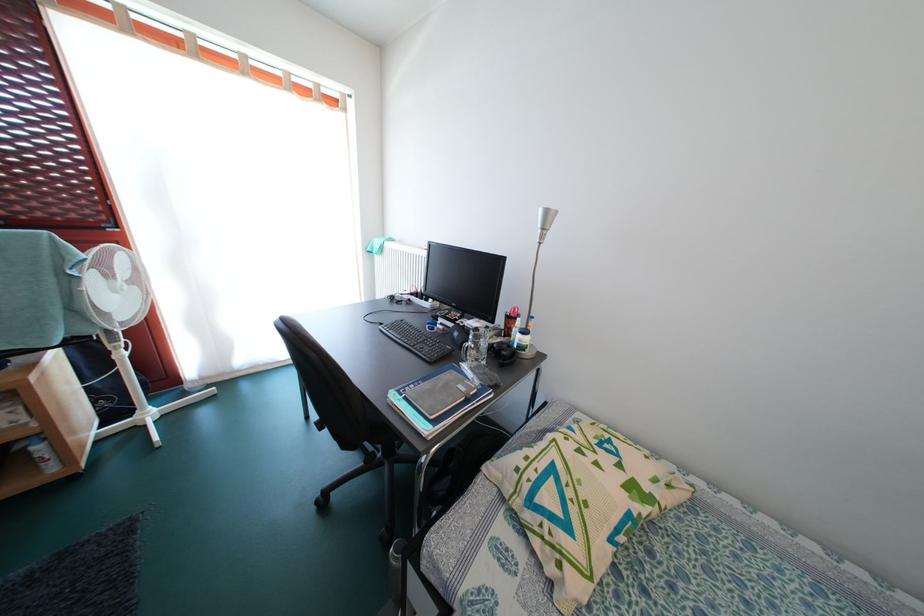
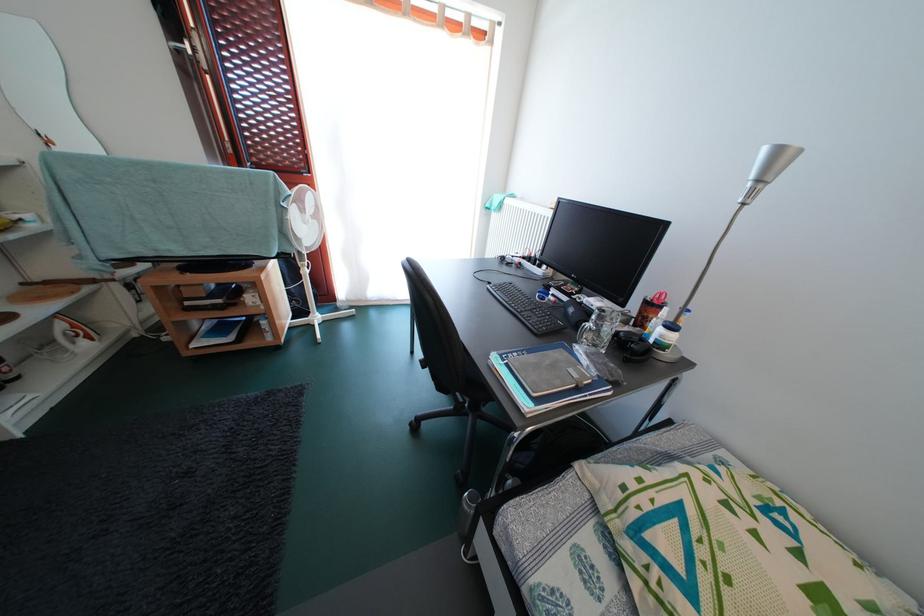
In the second image, find the point that corresponds to (514,365) in the first image.

(640, 360)